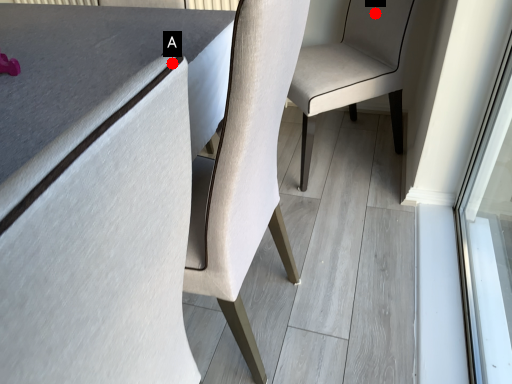
Question: Two points are circled on the image, labeled by A and B beside each circle. Among these points, which one is nearest to the camera?

Choices:
 (A) A is closer
 (B) B is closer

Answer: (A)